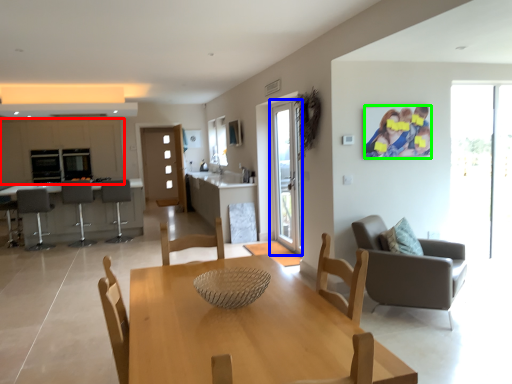
Question: Estimate the real-world distances between objects in this image. Which object is closer to cabinetry (highlighted by a red box), screen door (highlighted by a blue box) or couple (highlighted by a green box)?

Choices:
 (A) screen door
 (B) couple

Answer: (A)